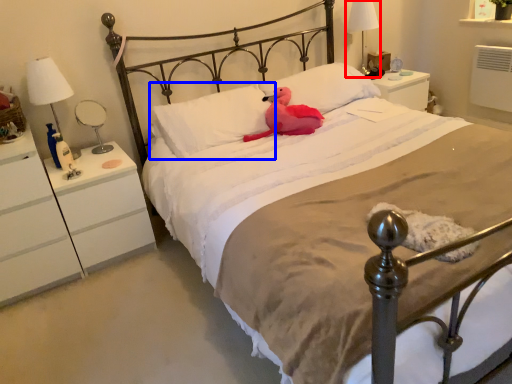
Question: Among these objects, which one is farthest to the camera, bedside lamp (highlighted by a red box) or pillow (highlighted by a blue box)?

Choices:
 (A) bedside lamp
 (B) pillow

Answer: (A)